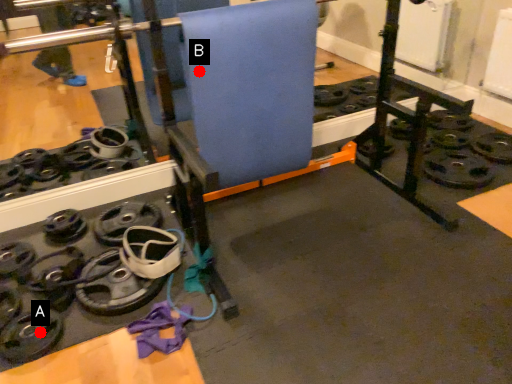
Question: Two points are circled on the image, labeled by A and B beside each circle. Which of the following is the closest to the observer?

Choices:
 (A) A is closer
 (B) B is closer

Answer: (A)